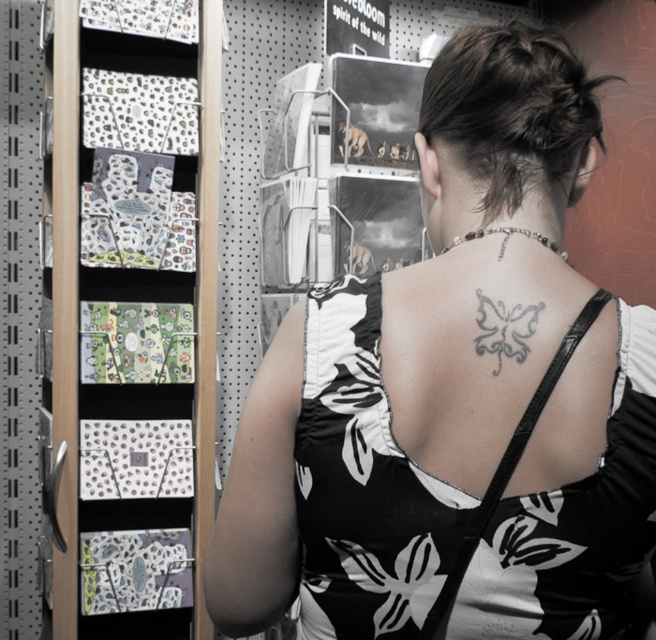
Does dark brown hair at upper center have a larger size compared to gray/black ink butterfly at upper back?

Indeed, dark brown hair at upper center has a larger size compared to gray/black ink butterfly at upper back.

Does point (483, 125) come closer to viewer compared to point (523, 348)?

No.

I want to click on dark brown hair at upper center, so click(x=501, y=177).

Does point (512, 317) come in front of point (564, 257)?

Yes, it is.

Is gray/black ink butterfly at upper back shorter than silver metallic necklace at upper center?

No, gray/black ink butterfly at upper back is not shorter than silver metallic necklace at upper center.

Find the location of a particular element. gray/black ink butterfly at upper back is located at coordinates (504, 328).

Locate an element on the screen. Image resolution: width=656 pixels, height=640 pixels. gray/black ink butterfly at upper back is located at coordinates (504, 328).

Which of these two, dark brown hair at upper center or silver metallic necklace at upper center, stands shorter?

With less height is silver metallic necklace at upper center.

Who is taller, dark brown hair at upper center or silver metallic necklace at upper center?

dark brown hair at upper center

Locate an element on the screen. Image resolution: width=656 pixels, height=640 pixels. dark brown hair at upper center is located at coordinates [501, 177].